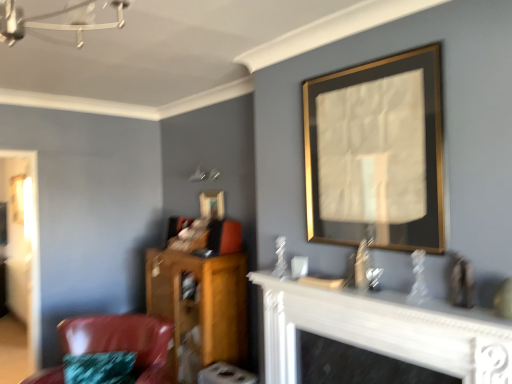
Question: Is white glossy fireplace at lower center outside of gold/metallic picture frame at upper right, arranged as the first picture frame when viewed from the front?

Choices:
 (A) no
 (B) yes

Answer: (B)

Question: Can you confirm if white glossy fireplace at lower center is thinner than gold/metallic picture frame at upper right, which is the 1th picture frame from right to left?

Choices:
 (A) no
 (B) yes

Answer: (A)

Question: From the image's perspective, is white glossy fireplace at lower center beneath gold/metallic picture frame at upper right, arranged as the first picture frame when viewed from the front?

Choices:
 (A) no
 (B) yes

Answer: (B)

Question: From a real-world perspective, is white glossy fireplace at lower center located higher than gold/metallic picture frame at upper right, which is the second picture frame in back-to-front order?

Choices:
 (A) yes
 (B) no

Answer: (B)

Question: Can you see white glossy fireplace at lower center touching gold/metallic picture frame at upper right, acting as the 2th picture frame starting from the left?

Choices:
 (A) no
 (B) yes

Answer: (A)

Question: From the image's perspective, is white glossy fireplace at lower center above gold/metallic picture frame at upper right, which is the second picture frame in back-to-front order?

Choices:
 (A) yes
 (B) no

Answer: (B)

Question: From a real-world perspective, is wooden cabinet at lower left on top of gold/metallic picture frame at upper right, which is the second picture frame in back-to-front order?

Choices:
 (A) yes
 (B) no

Answer: (B)

Question: Considering the relative sizes of wooden cabinet at lower left and gold/metallic picture frame at upper right, which is the 1th picture frame from right to left, in the image provided, is wooden cabinet at lower left taller than gold/metallic picture frame at upper right, which is the 1th picture frame from right to left,?

Choices:
 (A) no
 (B) yes

Answer: (B)

Question: Can you confirm if wooden cabinet at lower left is smaller than gold/metallic picture frame at upper right, which is the second picture frame in back-to-front order?

Choices:
 (A) yes
 (B) no

Answer: (B)

Question: Is wooden cabinet at lower left thinner than gold/metallic picture frame at upper right, arranged as the first picture frame when viewed from the front?

Choices:
 (A) yes
 (B) no

Answer: (B)

Question: Is wooden cabinet at lower left to the left of gold/metallic picture frame at upper right, which is the second picture frame in back-to-front order, from the viewer's perspective?

Choices:
 (A) no
 (B) yes

Answer: (B)

Question: Is wooden cabinet at lower left wider than gold/metallic picture frame at upper right, acting as the 2th picture frame starting from the left?

Choices:
 (A) no
 (B) yes

Answer: (B)

Question: Does white glossy fireplace at lower center appear on the right side of gold-framed mirror at upper center, which appears as the first picture frame when viewed from the back?

Choices:
 (A) yes
 (B) no

Answer: (A)